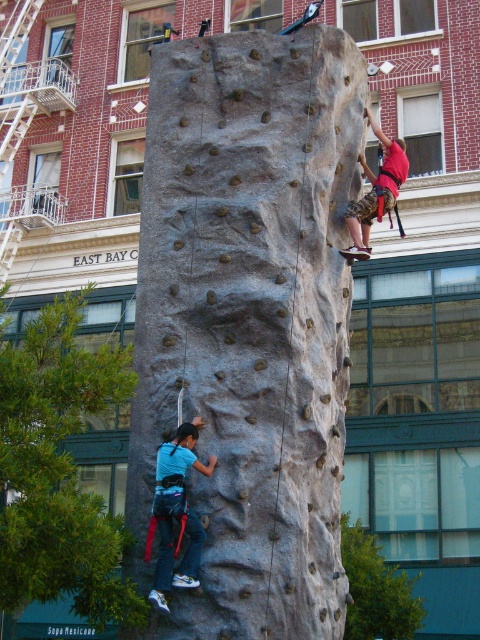
You are a climber on the urban climbing wall and need to reach the top. You see two points on the wall labeled as point (330, 188) and point (175, 484). Which point is closer to the top of the climbing wall?

Point (330, 188) is behind point (175, 484), so it is closer to the top of the climbing wall.

You are a photographer positioned at the base of the climbing wall. You want to take a photo of both climbers so that the climber at point (235, 632) and the climber at point (391, 164) are both visible without one blocking the other. Based on their positions, can you position yourself in a way that ensures both are visible?

Point (235, 632) is in front of point (391, 164). To ensure both climbers are visible without obstruction, position yourself so that you can see around or above the front climber at point (235, 632) to capture the one behind at point (391, 164).

Based on the photo, what are the coordinates of the smooth gray rock climbing at center?

The coordinates of the smooth gray rock climbing at center are at point (250, 320).